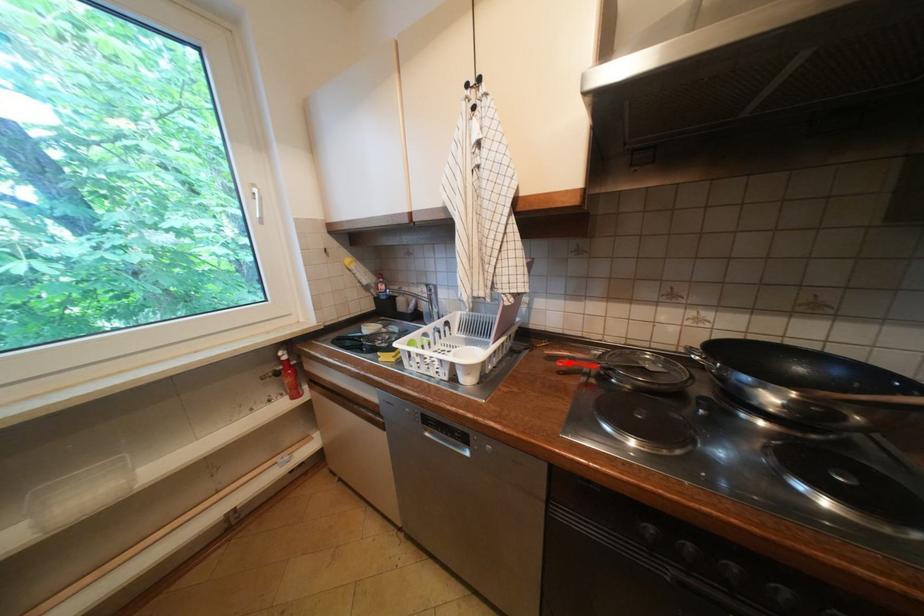
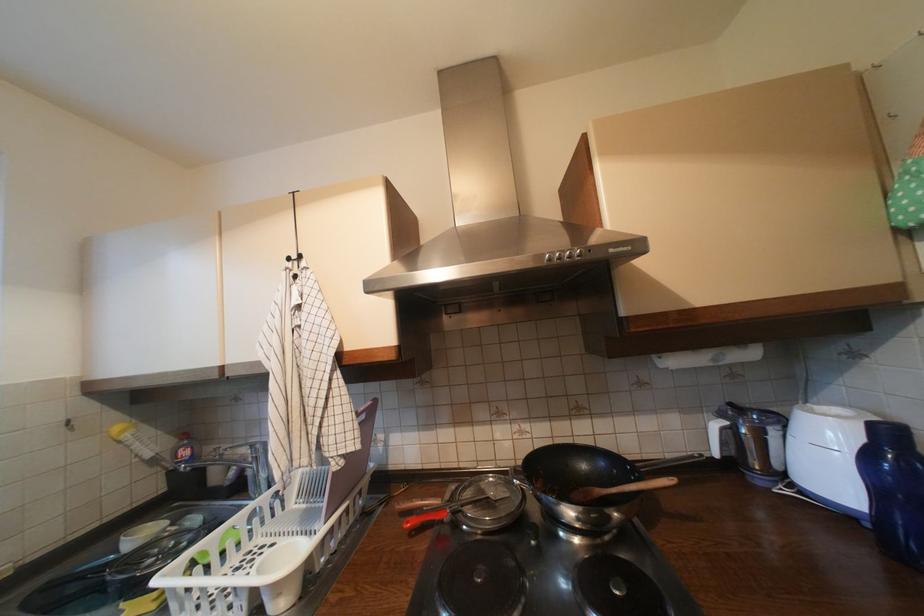
In the second image, find the point that corresponds to the highlighted location in the first image.

(417, 524)